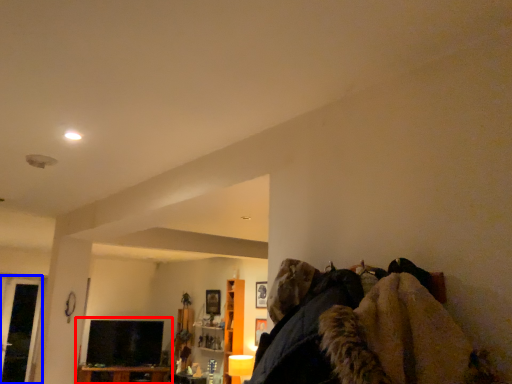
Question: Which of the following is the farthest to the observer, entertainment center (highlighted by a red box) or glass door (highlighted by a blue box)?

Choices:
 (A) entertainment center
 (B) glass door

Answer: (A)